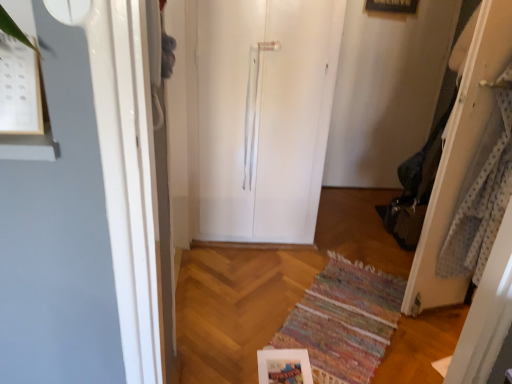
What do you see at coordinates (344, 321) in the screenshot? I see `multicolored woven mat at center` at bounding box center [344, 321].

Find the location of a particular element. Image resolution: width=512 pixels, height=384 pixels. multicolored woven mat at center is located at coordinates (344, 321).

At what (x,y) coordinates should I click in order to perform the action: click on multicolored woven mat at center. Please return your answer as a coordinate pair (x, y). The width and height of the screenshot is (512, 384). Looking at the image, I should click on (344, 321).